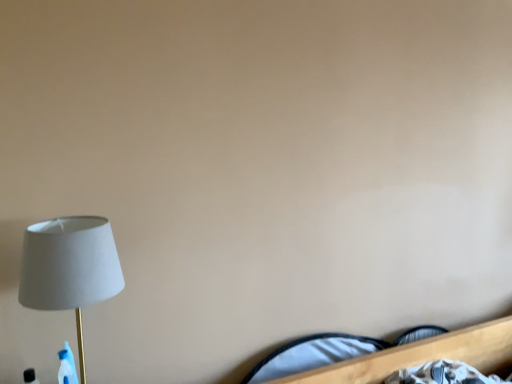
Question: Is white fabric lamp at left positioned in front of white fabric bed at lower right?

Choices:
 (A) yes
 (B) no

Answer: (A)

Question: Would you say white fabric lamp at left is a long distance from white fabric bed at lower right?

Choices:
 (A) no
 (B) yes

Answer: (A)

Question: From a real-world perspective, does white fabric lamp at left stand above white fabric bed at lower right?

Choices:
 (A) no
 (B) yes

Answer: (B)

Question: Is white fabric lamp at left to the right of white fabric bed at lower right from the viewer's perspective?

Choices:
 (A) no
 (B) yes

Answer: (A)

Question: Does white fabric lamp at left have a lesser width compared to white fabric bed at lower right?

Choices:
 (A) yes
 (B) no

Answer: (B)

Question: Is white fabric lamp at left wider than white fabric bed at lower right?

Choices:
 (A) no
 (B) yes

Answer: (B)

Question: Is white fabric bed at lower right at the left side of white fabric lamp at left?

Choices:
 (A) no
 (B) yes

Answer: (A)

Question: Can you confirm if white fabric bed at lower right is thinner than white fabric lamp at left?

Choices:
 (A) no
 (B) yes

Answer: (B)

Question: Can you confirm if white fabric bed at lower right is shorter than white fabric lamp at left?

Choices:
 (A) yes
 (B) no

Answer: (A)

Question: Is white fabric bed at lower right directly adjacent to white fabric lamp at left?

Choices:
 (A) no
 (B) yes

Answer: (A)

Question: Is white fabric bed at lower right not within white fabric lamp at left?

Choices:
 (A) yes
 (B) no

Answer: (A)

Question: Considering the relative sizes of white fabric bed at lower right and white fabric lamp at left in the image provided, is white fabric bed at lower right taller than white fabric lamp at left?

Choices:
 (A) no
 (B) yes

Answer: (A)

Question: Is point (387, 354) closer or farther from the camera than point (96, 278)?

Choices:
 (A) farther
 (B) closer

Answer: (A)